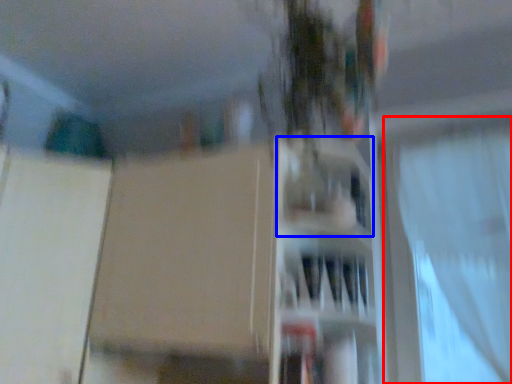
Question: Which object appears closest to the camera in this image, curtain (highlighted by a red box) or shelf (highlighted by a blue box)?

Choices:
 (A) curtain
 (B) shelf

Answer: (B)